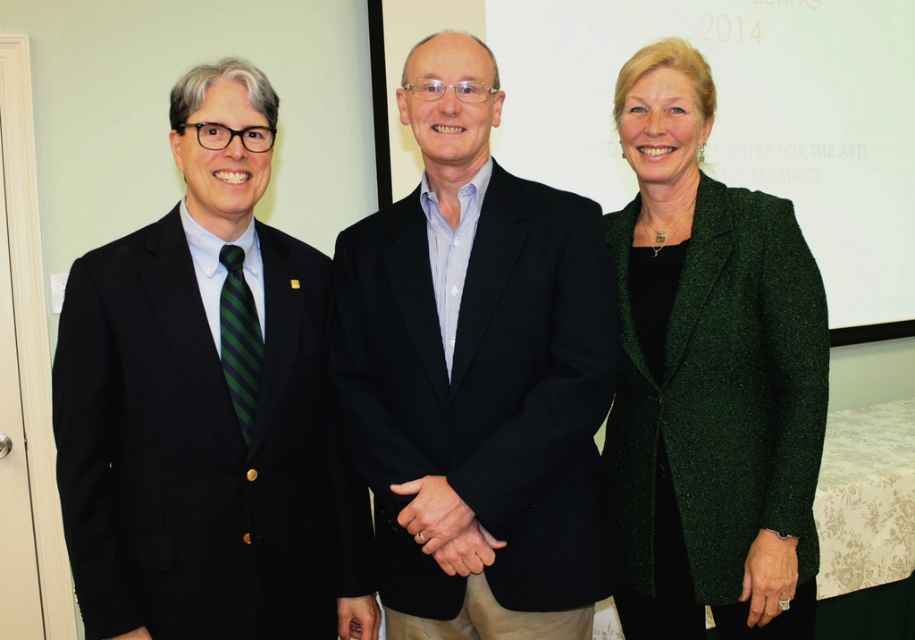
Question: Among these points, which one is nearest to the camera?

Choices:
 (A) (774, 472)
 (B) (368, 480)

Answer: (B)

Question: Does matte black suit at left have a larger size compared to green textured blazer at center?

Choices:
 (A) yes
 (B) no

Answer: (A)

Question: Which point is farther to the camera?

Choices:
 (A) black matte suit at center
 (B) matte black suit at left
 (C) green textured blazer at center

Answer: (C)

Question: Which of the following is the farthest from the observer?

Choices:
 (A) (770, 381)
 (B) (213, 225)
 (C) (587, 512)

Answer: (A)

Question: In this image, where is matte black suit at left located relative to black matte suit at center?

Choices:
 (A) above
 (B) below

Answer: (B)

Question: Can you confirm if black matte suit at center is smaller than green textured blazer at center?

Choices:
 (A) yes
 (B) no

Answer: (B)